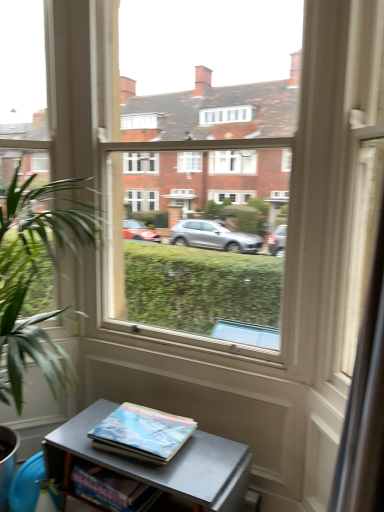
Describe the element at coordinates (142, 433) in the screenshot. The height and width of the screenshot is (512, 384). I see `hardcover book at center, marked as the 1th book in a top-to-bottom arrangement` at that location.

Measure the distance between point (184, 489) and camera.

1.49 meters.

Looking at this image, what is the approximate width of metallic gray table at lower center?

It is 15.47 inches.

Locate an element on the screen. This screenshot has width=384, height=512. green leafy plant at left is located at coordinates (35, 278).

This screenshot has width=384, height=512. I want to click on hardcover book at lower center, which appears as the 1th book when ordered from the bottom, so click(x=112, y=488).

This screenshot has width=384, height=512. I want to click on transparent glass door at center, so click(339, 213).

This screenshot has height=512, width=384. I want to click on hardcover book at center, the second book ordered from the bottom, so [x=142, y=433].

Considering the sizes of objects green leafy plant at left and hardcover book at center, the second book ordered from the bottom, in the image provided, who is wider, green leafy plant at left or hardcover book at center, the second book ordered from the bottom,?

With larger width is green leafy plant at left.

Considering the sizes of green leafy plant at left and hardcover book at center, the second book ordered from the bottom, in the image, is green leafy plant at left taller or shorter than hardcover book at center, the second book ordered from the bottom,?

Clearly, green leafy plant at left is taller compared to hardcover book at center, the second book ordered from the bottom.

Are green leafy plant at left and hardcover book at center, marked as the 1th book in a top-to-bottom arrangement, making contact?

They are not placed beside each other.

Could you measure the distance between green leafy plant at left and hardcover book at center, the second book ordered from the bottom?

They are 23.85 inches apart.

Could you tell me if transparent glass door at center is facing green leafy plant at left?

No, transparent glass door at center is not oriented towards green leafy plant at left.

Are transparent glass door at center and green leafy plant at left located far from each other?

transparent glass door at center is far away from green leafy plant at left.

From the picture: Is transparent glass door at center in front of green leafy plant at left?

Yes, it is.

Is transparent glass door at center not inside green leafy plant at left?

That's correct, transparent glass door at center is outside of green leafy plant at left.

Considering the sizes of objects hardcover book at lower center, which appears as the 1th book when ordered from the bottom, and green leafy plant at left in the image provided, who is thinner, hardcover book at lower center, which appears as the 1th book when ordered from the bottom, or green leafy plant at left?

hardcover book at lower center, which appears as the 1th book when ordered from the bottom, is thinner.

Is hardcover book at lower center, which appears as the 1th book when ordered from the bottom, not near green leafy plant at left?

Actually, hardcover book at lower center, which appears as the 1th book when ordered from the bottom, and green leafy plant at left are a little close together.

Would you say hardcover book at lower center, which appears as the 1th book when ordered from the bottom, is outside green leafy plant at left?

No, hardcover book at lower center, which appears as the 1th book when ordered from the bottom, is inside or overlapping with green leafy plant at left.

Consider the image. From the image's perspective, is hardcover book at lower center, which appears as the 1th book when ordered from the bottom, above or below green leafy plant at left?

From the image's perspective, hardcover book at lower center, which appears as the 1th book when ordered from the bottom, appears below green leafy plant at left.

Is hardcover book at center, the second book ordered from the bottom, not close to green leafy plant at left?

No, there isn't a large distance between hardcover book at center, the second book ordered from the bottom, and green leafy plant at left.

Is hardcover book at center, marked as the 1th book in a top-to-bottom arrangement, completely or partially outside of green leafy plant at left?

Yes, hardcover book at center, marked as the 1th book in a top-to-bottom arrangement, is outside of green leafy plant at left.

In the scene shown: Which is in front, hardcover book at center, the second book ordered from the bottom, or green leafy plant at left?

green leafy plant at left.

From a real-world perspective, is hardcover book at center, the second book ordered from the bottom, physically below green leafy plant at left?

Indeed, from a real-world perspective, hardcover book at center, the second book ordered from the bottom, is positioned beneath green leafy plant at left.

From a real-world perspective, is hardcover book at center, marked as the 1th book in a top-to-bottom arrangement, positioned over metallic gray table at lower center based on gravity?

Correct, in the physical world, hardcover book at center, marked as the 1th book in a top-to-bottom arrangement, is higher than metallic gray table at lower center.

Between hardcover book at center, the second book ordered from the bottom, and metallic gray table at lower center, which one has larger size?

With larger size is metallic gray table at lower center.

Based on the photo, in terms of width, does hardcover book at center, marked as the 1th book in a top-to-bottom arrangement, look wider or thinner when compared to metallic gray table at lower center?

Clearly, hardcover book at center, marked as the 1th book in a top-to-bottom arrangement, has less width compared to metallic gray table at lower center.

Is hardcover book at center, the second book ordered from the bottom, placed right next to metallic gray table at lower center?

Yes.

From a real-world perspective, is hardcover book at lower center, which appears as the 1th book when ordered from the bottom, physically located above or below transparent glass door at center?

hardcover book at lower center, which appears as the 1th book when ordered from the bottom, is below transparent glass door at center.

Does hardcover book at lower center, the 2th book from the top, have a lesser width compared to transparent glass door at center?

Correct, the width of hardcover book at lower center, the 2th book from the top, is less than that of transparent glass door at center.

Is hardcover book at lower center, the 2th book from the top, behind transparent glass door at center?

Yes, hardcover book at lower center, the 2th book from the top, is further from the viewer.

Between point (118, 503) and point (374, 61), which one is positioned behind?

The point (118, 503) is farther.

Consider the image. What's the angular difference between hardcover book at center, the second book ordered from the bottom, and hardcover book at lower center, which appears as the 1th book when ordered from the bottom,'s facing directions?

hardcover book at center, the second book ordered from the bottom, and hardcover book at lower center, which appears as the 1th book when ordered from the bottom, are facing 11.3 degrees away from each other.

Which object is wider, hardcover book at center, the second book ordered from the bottom, or hardcover book at lower center, the 2th book from the top?

hardcover book at center, the second book ordered from the bottom.

The image size is (384, 512). I want to click on book above the hardcover book at lower center, the 2th book from the top (from a real-world perspective), so click(142, 433).

Could you tell me if hardcover book at center, the second book ordered from the bottom, is facing hardcover book at lower center, which appears as the 1th book when ordered from the bottom?

No, hardcover book at center, the second book ordered from the bottom, is not aimed at hardcover book at lower center, which appears as the 1th book when ordered from the bottom.

Where is `the 2nd book to the right when counting from the green leafy plant at left`? the 2nd book to the right when counting from the green leafy plant at left is located at coordinates (142, 433).

Locate an element on the screen. This screenshot has height=512, width=384. houseplant that appears behind the transparent glass door at center is located at coordinates (35, 278).

Considering their positions, is hardcover book at lower center, the 2th book from the top, positioned closer to green leafy plant at left than transparent glass door at center?

hardcover book at lower center, the 2th book from the top, lies closer to green leafy plant at left than the other object.

Based on their spatial positions, is transparent glass door at center or hardcover book at lower center, which appears as the 1th book when ordered from the bottom, closer to green leafy plant at left?

hardcover book at lower center, which appears as the 1th book when ordered from the bottom.

Looking at the image, which one is located closer to metallic gray table at lower center, transparent glass door at center or hardcover book at lower center, the 2th book from the top?

hardcover book at lower center, the 2th book from the top.

When comparing their distances from metallic gray table at lower center, does hardcover book at center, the second book ordered from the bottom, or green leafy plant at left seem closer?

Based on the image, hardcover book at center, the second book ordered from the bottom, appears to be nearer to metallic gray table at lower center.

Looking at the image, which one is located further to metallic gray table at lower center, transparent glass door at center or hardcover book at center, marked as the 1th book in a top-to-bottom arrangement?

Based on the image, transparent glass door at center appears to be further to metallic gray table at lower center.

When comparing their distances from transparent glass door at center, does green leafy plant at left or metallic gray table at lower center seem further?

green leafy plant at left is positioned further to the anchor transparent glass door at center.

From the image, which object appears to be nearer to hardcover book at center, the second book ordered from the bottom, hardcover book at lower center, the 2th book from the top, or green leafy plant at left?

Based on the image, hardcover book at lower center, the 2th book from the top, appears to be nearer to hardcover book at center, the second book ordered from the bottom.

Looking at the image, which one is located closer to transparent glass door at center, hardcover book at center, marked as the 1th book in a top-to-bottom arrangement, or hardcover book at lower center, the 2th book from the top?

hardcover book at center, marked as the 1th book in a top-to-bottom arrangement.

Image resolution: width=384 pixels, height=512 pixels. I want to click on book that lies between hardcover book at center, marked as the 1th book in a top-to-bottom arrangement, and metallic gray table at lower center from top to bottom, so click(x=112, y=488).

Identify the location of table between transparent glass door at center and hardcover book at center, marked as the 1th book in a top-to-bottom arrangement, along the z-axis. (156, 465).

Identify the location of table located between green leafy plant at left and transparent glass door at center in the left-right direction. The image size is (384, 512). (156, 465).

At what (x,y) coordinates should I click in order to perform the action: click on book between transparent glass door at center and hardcover book at lower center, the 2th book from the top, along the z-axis. Please return your answer as a coordinate pair (x, y). The image size is (384, 512). Looking at the image, I should click on (142, 433).